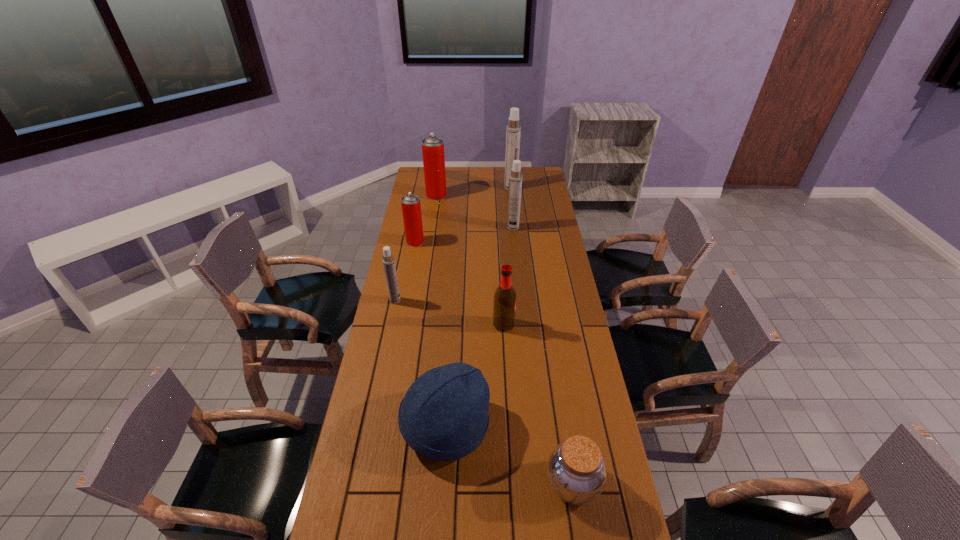
Image resolution: width=960 pixels, height=540 pixels. Identify the location of vacant area situated on the left of the jar. (492, 484).

This screenshot has height=540, width=960. Identify the location of object that is at the far edge. (513, 132).

Identify the location of skullcap situated at the left edge. The height and width of the screenshot is (540, 960). 443,416.

Where is `object at the right edge`? This screenshot has width=960, height=540. object at the right edge is located at coordinates (576, 471).

The width and height of the screenshot is (960, 540). Identify the location of vacant space at the left edge of the desktop. (379, 349).

This screenshot has width=960, height=540. I want to click on free space at the right edge of the desktop, so click(564, 334).

At what (x,y) coordinates should I click in order to perform the action: click on free space between the fourth object from right to left and the fourth farthest aerosol can. Please return your answer as a coordinate pair (x, y). Looking at the image, I should click on (460, 284).

Where is `free spot between the bigger red aerosol can and the third shortest object`? The height and width of the screenshot is (540, 960). free spot between the bigger red aerosol can and the third shortest object is located at coordinates (441, 311).

Identify the location of free space between the tallest object and the bigger red aerosol can. The image size is (960, 540). (473, 192).

You are a GUI agent. You are given a task and a screenshot of the screen. Output one action in this format:
    pyautogui.click(x=<x>, y=<y>)
    Task: Click on the empty space between the farther red aerosol can and the jar
    Image resolution: width=960 pixels, height=540 pixels.
    Given the screenshot: What is the action you would take?
    pyautogui.click(x=505, y=340)